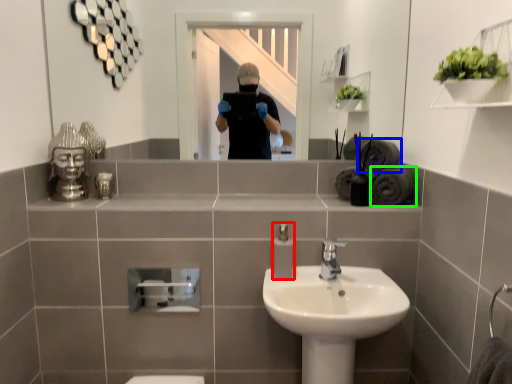
Question: Which is farther away from soap dispenser (highlighted by a red box)? bath towel (highlighted by a blue box) or bath towel (highlighted by a green box)?

Choices:
 (A) bath towel
 (B) bath towel

Answer: (A)